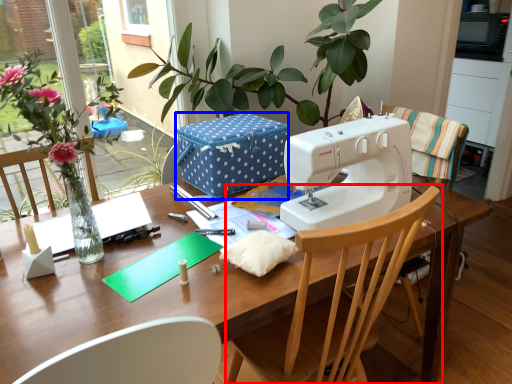
Question: Which of the following is the farthest to the observer, chair (highlighted by a red box) or cardboard box (highlighted by a blue box)?

Choices:
 (A) chair
 (B) cardboard box

Answer: (B)